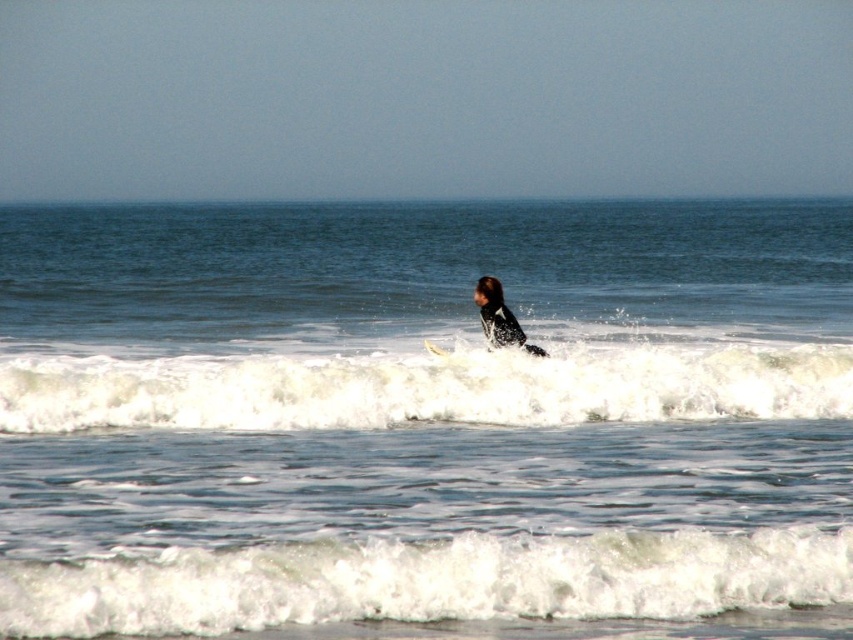
Question: Can you confirm if blue water at center is positioned above white foamy wave at center?

Choices:
 (A) yes
 (B) no

Answer: (A)

Question: Among these points, which one is farthest from the camera?

Choices:
 (A) (436, 346)
 (B) (54, 499)

Answer: (A)

Question: Can you confirm if black wetsuit at center is wider than white foam surfboard at center?

Choices:
 (A) yes
 (B) no

Answer: (A)

Question: Does white foamy wave at center have a lesser width compared to white foam surfboard at center?

Choices:
 (A) yes
 (B) no

Answer: (B)

Question: Which point is closer to the camera?

Choices:
 (A) blue water at center
 (B) black wetsuit at center
 (C) white foamy wave at center
 (D) white foamy wave at lower center

Answer: (D)

Question: Considering the real-world distances, which object is closest to the blue water at center?

Choices:
 (A) black wetsuit at center
 (B) white foamy wave at center
 (C) white foamy wave at lower center

Answer: (A)